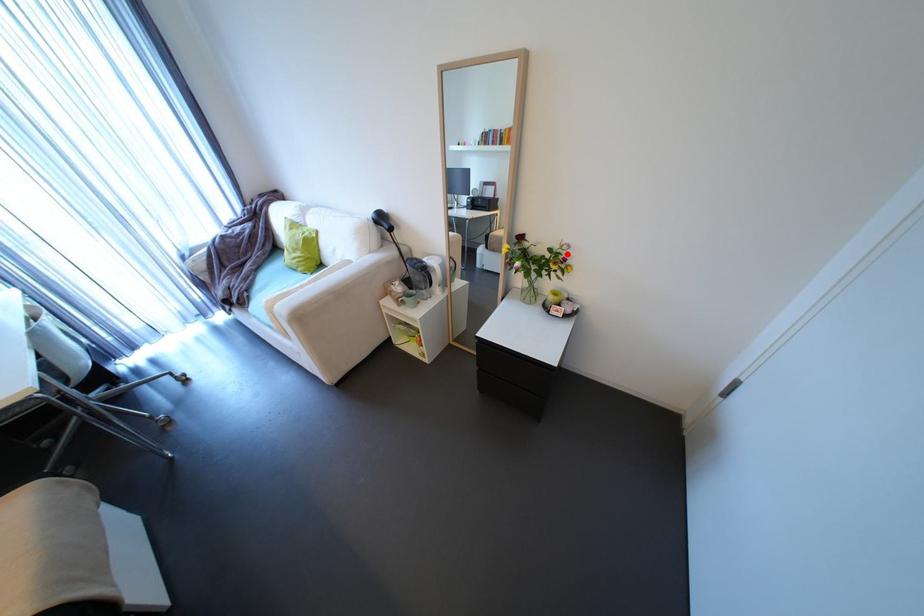
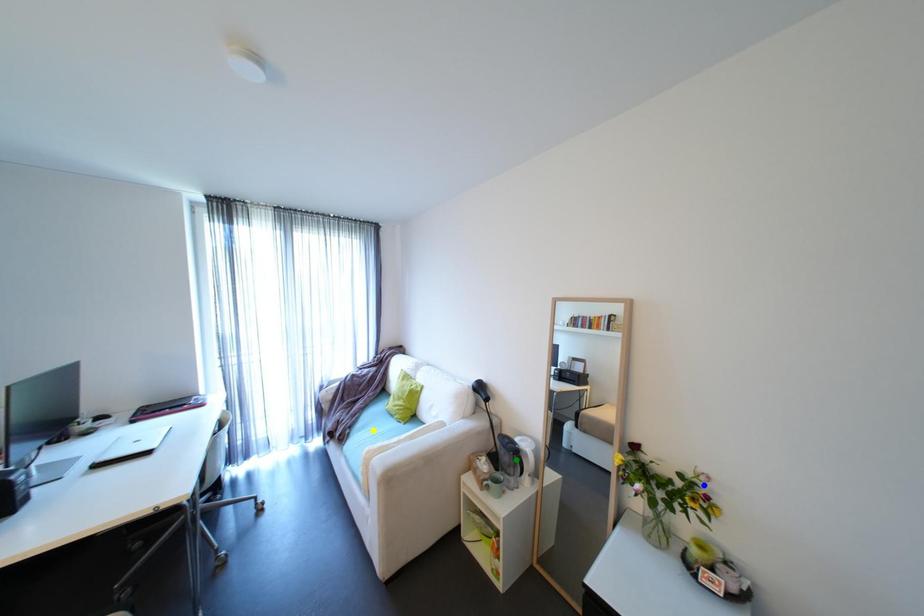
Question: I am providing you with two images of the same scene from different viewpoints. A red point is marked on the first image. You are given multiple points on the second image. Which point in image 2 is actually the same real-world point as the red point in image 1?

Choices:
 (A) green point
 (B) blue point
 (C) yellow point

Answer: (B)